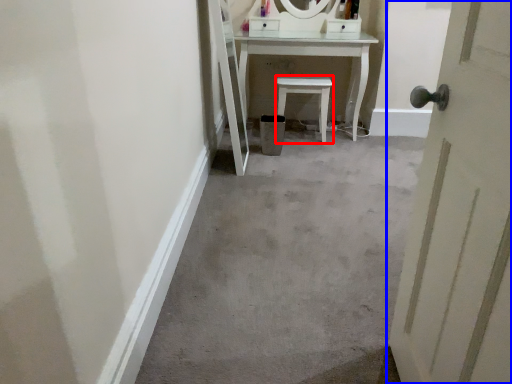
Question: Which point is closer to the camera, furniture (highlighted by a red box) or door (highlighted by a blue box)?

Choices:
 (A) furniture
 (B) door

Answer: (B)